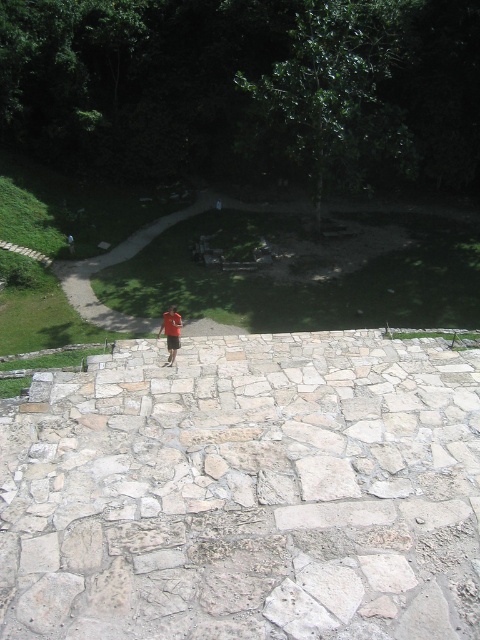
Question: Which object is farther from the camera taking this photo?

Choices:
 (A) red fabric shorts at center
 (B) green grass at lower left

Answer: (B)

Question: Can you confirm if natural stone at center is positioned to the left of red fabric shorts at center?

Choices:
 (A) yes
 (B) no

Answer: (B)

Question: Does natural stone at center appear on the left side of red fabric shorts at center?

Choices:
 (A) yes
 (B) no

Answer: (B)

Question: Based on their relative distances, which object is nearer to the natural stone at center?

Choices:
 (A) red fabric shorts at center
 (B) green grass at lower left

Answer: (A)

Question: Does natural stone at center lie behind red fabric shorts at center?

Choices:
 (A) no
 (B) yes

Answer: (A)

Question: Which point is farther to the camera?

Choices:
 (A) red fabric shorts at center
 (B) green grass at lower left

Answer: (B)